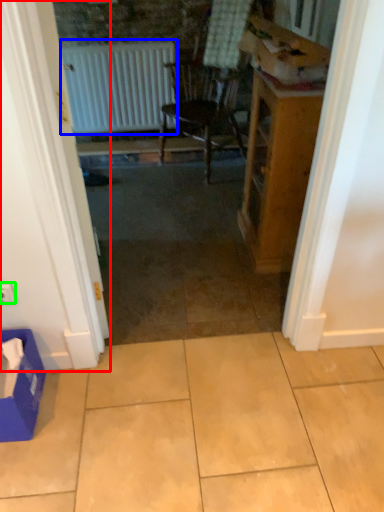
Question: Which is nearer to the door (highlighted by a red box)? radiator (highlighted by a blue box) or electric outlet (highlighted by a green box).

Choices:
 (A) radiator
 (B) electric outlet

Answer: (B)